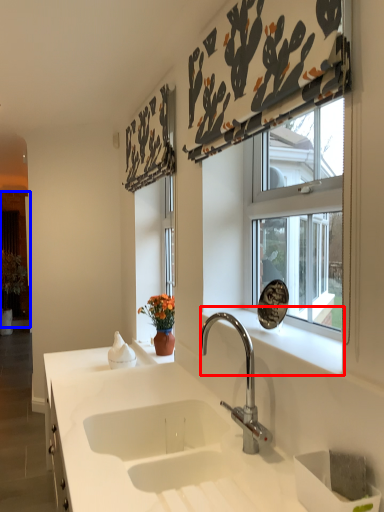
Question: Among these objects, which one is farthest to the camera, window sill (highlighted by a red box) or screen door (highlighted by a blue box)?

Choices:
 (A) window sill
 (B) screen door

Answer: (B)